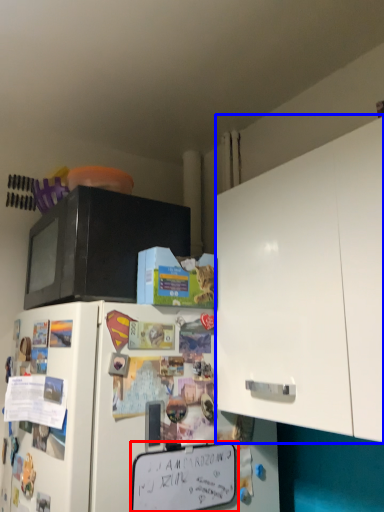
Question: Which of the following is the closest to the observer, bulletin board (highlighted by a red box) or cabinetry (highlighted by a blue box)?

Choices:
 (A) bulletin board
 (B) cabinetry

Answer: (B)